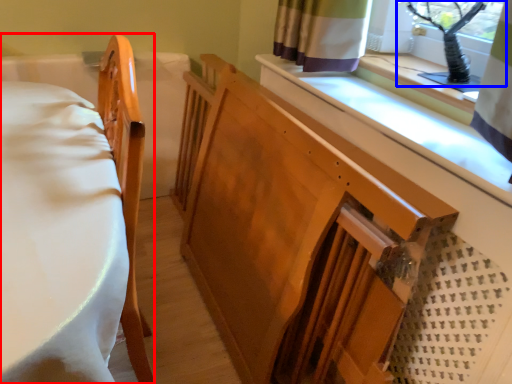
Question: Which of the following is the closest to the observer, furniture (highlighted by a red box) or window screen (highlighted by a blue box)?

Choices:
 (A) furniture
 (B) window screen

Answer: (A)